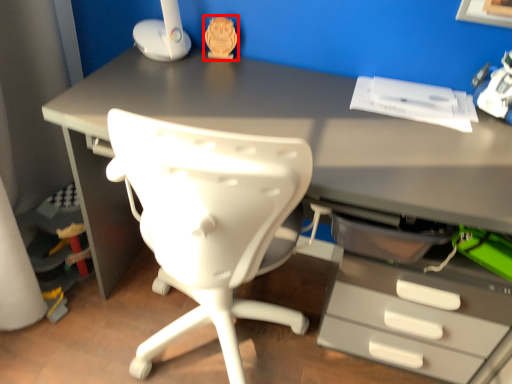
Question: From the image's perspective, what is the correct spatial positioning of toy (annotated by the red box) in reference to toy?

Choices:
 (A) below
 (B) above

Answer: (B)